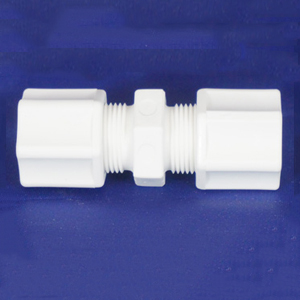
You are a GUI agent. You are given a task and a screenshot of the screen. Output one action in this format:
    pyautogui.click(x=<x>, y=<y>)
    Task: Click on the blue table
    Image resolution: width=300 pixels, height=300 pixels.
    Given the screenshot: What is the action you would take?
    (x=146, y=230)